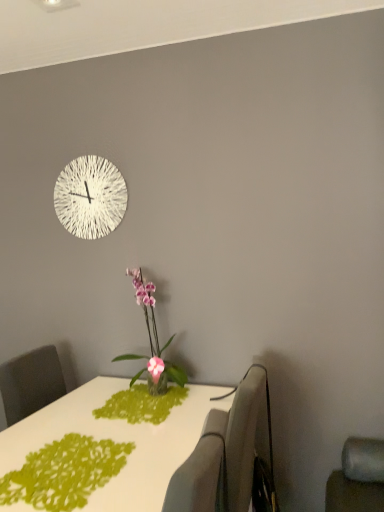
You are a GUI agent. You are given a task and a screenshot of the screen. Output one action in this format:
    pyautogui.click(x=<x>, y=<y>)
    Task: Click on the free spot to the right of green paper doily at lower left
    
    Given the screenshot: What is the action you would take?
    pyautogui.click(x=155, y=460)